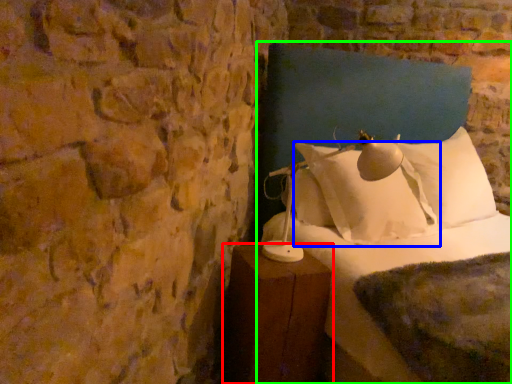
Question: Based on their relative distances, which object is farther from furniture (highlighted by a red box)? Choose from pillow (highlighted by a blue box) and bed (highlighted by a green box).

Choices:
 (A) pillow
 (B) bed

Answer: (A)